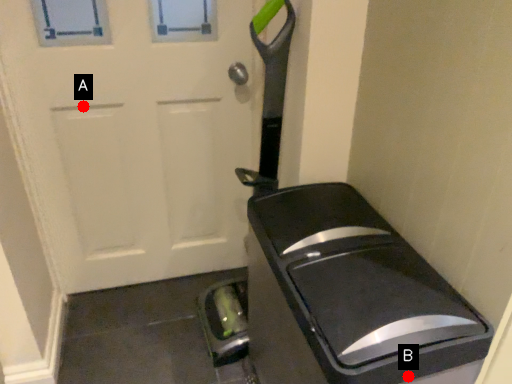
Question: Two points are circled on the image, labeled by A and B beside each circle. Among these points, which one is nearest to the camera?

Choices:
 (A) A is closer
 (B) B is closer

Answer: (B)